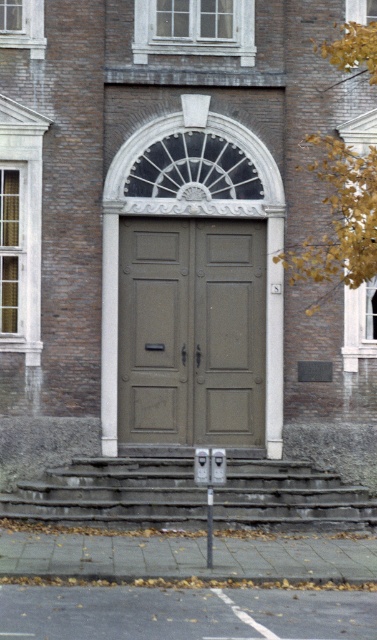
You are standing at the bottom of the stone steps leading to the entrance. You see two points marked on the entrance area. Which point is closer to you, point [265,257] or point [294,490]?

Point [265,257] is further to the viewer than point [294,490]. Therefore, point [294,490] is closer to you.

You are a delivery person carrying a large package and need to enter the building. You see the matte wood door at center and the gray stone stairs at center. Which one takes up more space in the image?

The gray stone stairs at center takes up more space in the image because the matte wood door at center occupies less space than gray stone stairs at center.